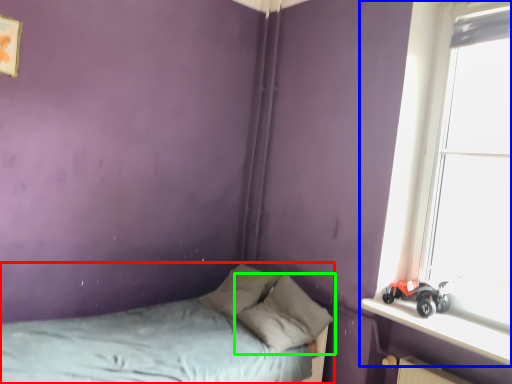
Question: Based on their relative distances, which object is nearer to bed (highlighted by a red box)? Choose from window (highlighted by a blue box) and pillow (highlighted by a green box).

Choices:
 (A) window
 (B) pillow

Answer: (B)